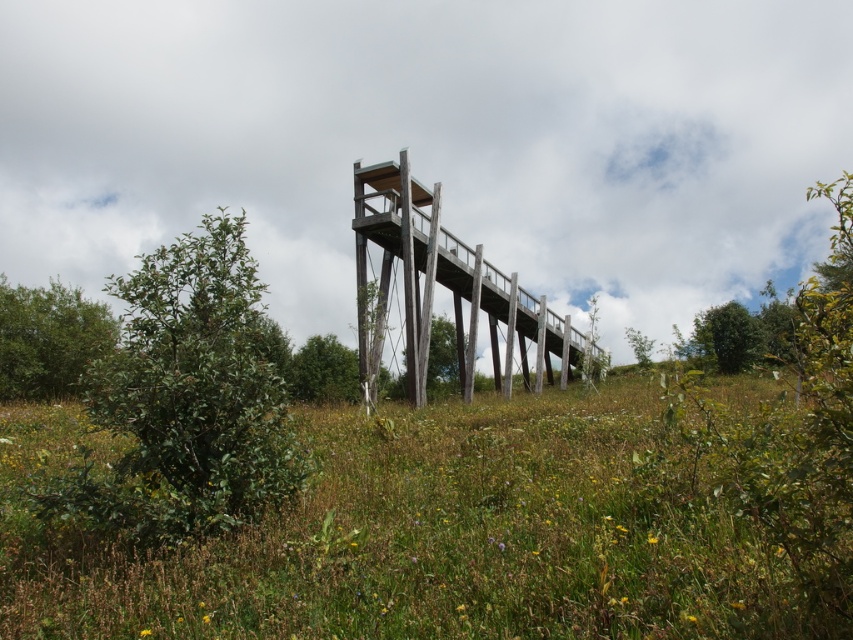
Measure the distance from green leafy tree at center to green leafy tree at right.

green leafy tree at center is 16.69 meters away from green leafy tree at right.

Who is lower down, green leafy tree at center or green leafy tree at right?

green leafy tree at center

Describe the element at coordinates (323, 371) in the screenshot. I see `green leafy tree at center` at that location.

The height and width of the screenshot is (640, 853). Identify the location of green leafy tree at center. (323, 371).

Measure the distance between green leafy tree at center and camera.

The distance of green leafy tree at center from camera is 25.61 meters.

Is green leafy tree at center to the right of green matte tree at center from the viewer's perspective?

In fact, green leafy tree at center is to the left of green matte tree at center.

Is point (300, 397) behind point (405, 388)?

No, it is not.

The image size is (853, 640). I want to click on green leafy tree at center, so click(x=323, y=371).

Can you confirm if green grass at center is positioned to the right of green leafy tree at right?

In fact, green grass at center is to the left of green leafy tree at right.

Can you confirm if green grass at center is positioned above green leafy tree at right?

Actually, green grass at center is below green leafy tree at right.

Where is `green grass at center`? The image size is (853, 640). green grass at center is located at coordinates (462, 525).